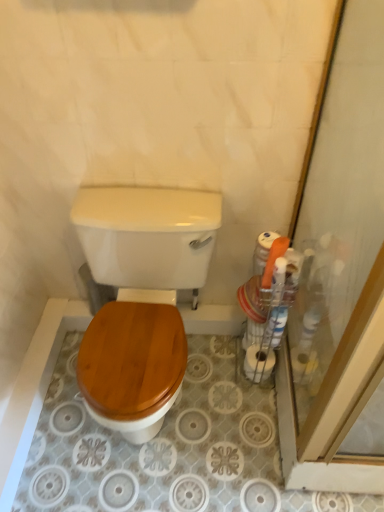
Question: Does point (175, 284) appear closer or farther from the camera than point (263, 372)?

Choices:
 (A) closer
 (B) farther

Answer: (A)

Question: From the image's perspective, is wooden toilet seat at center located above or below white matte toilet paper at right?

Choices:
 (A) above
 (B) below

Answer: (A)

Question: Which of these objects is positioned closest to the white matte toilet paper at right?

Choices:
 (A) transparent glass screen door at right
 (B) wooden toilet seat at center

Answer: (A)

Question: Considering the real-world distances, which object is closest to the white matte toilet paper at right?

Choices:
 (A) transparent glass screen door at right
 (B) wooden toilet seat at center

Answer: (A)